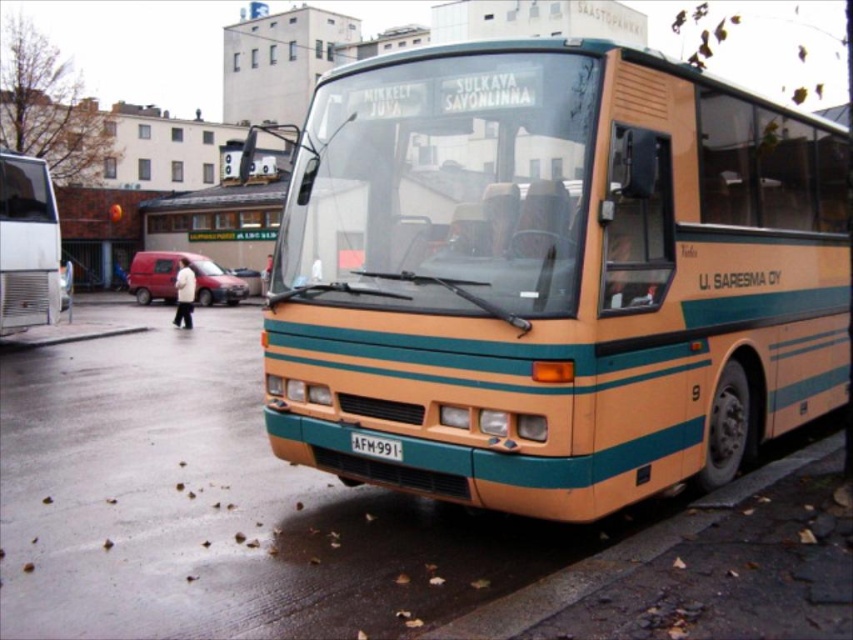
Question: Among these objects, which one is nearest to the camera?

Choices:
 (A) matte orange bus at center
 (B) white plastic license plate at center
 (C) metallic silver bus at left

Answer: (A)

Question: Among these points, which one is nearest to the camera?

Choices:
 (A) (381, 438)
 (B) (630, 493)
 (C) (12, 198)

Answer: (B)

Question: Does matte orange bus at center lie behind metallic silver bus at left?

Choices:
 (A) yes
 (B) no

Answer: (B)

Question: Considering the real-world distances, which object is farthest from the matte orange bus at center?

Choices:
 (A) white plastic license plate at center
 (B) metallic silver bus at left

Answer: (B)

Question: Can you confirm if metallic silver bus at left is positioned above white plastic license plate at center?

Choices:
 (A) yes
 (B) no

Answer: (A)

Question: Is matte orange bus at center positioned at the back of white plastic license plate at center?

Choices:
 (A) yes
 (B) no

Answer: (B)